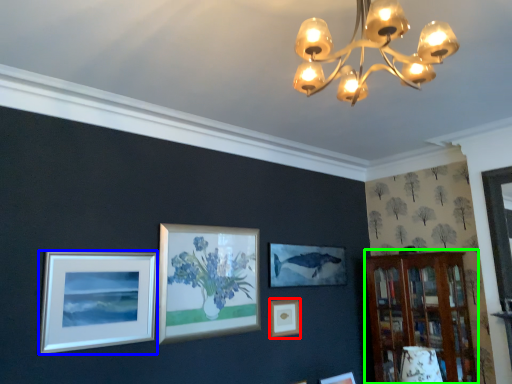
Question: Estimate the real-world distances between objects in this image. Which object is farther from picture frame (highlighted by a red box), picture frame (highlighted by a blue box) or bookshelf (highlighted by a green box)?

Choices:
 (A) picture frame
 (B) bookshelf

Answer: (A)